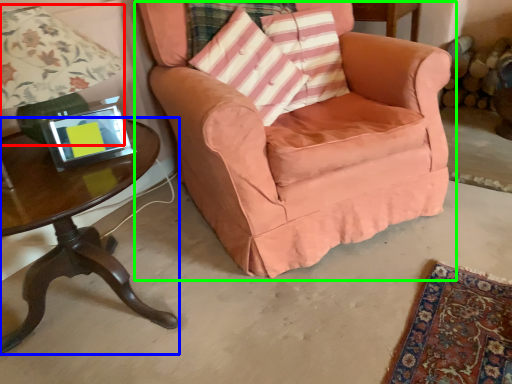
Question: Which is nearer to the lamp (highlighted by a red box)? table (highlighted by a blue box) or chair (highlighted by a green box).

Choices:
 (A) table
 (B) chair

Answer: (A)